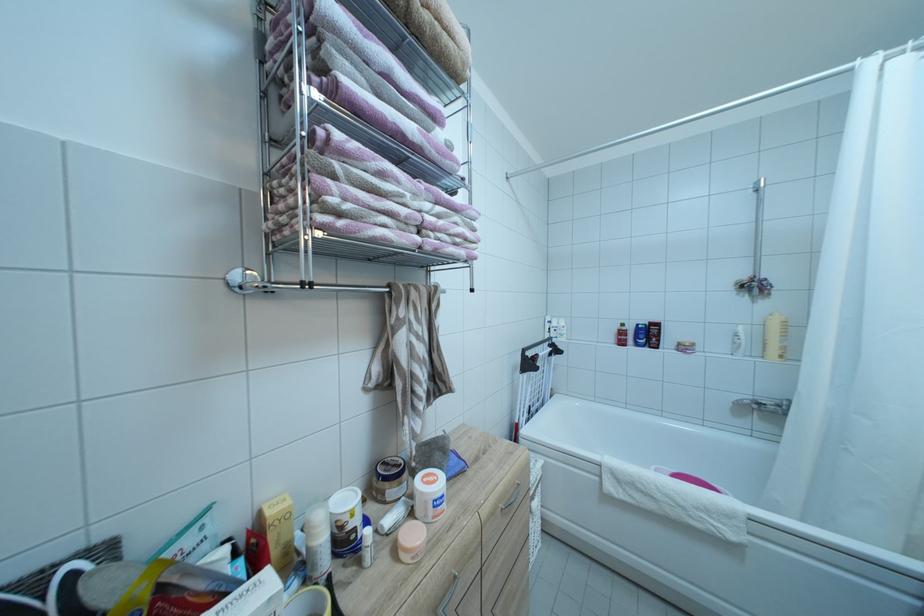
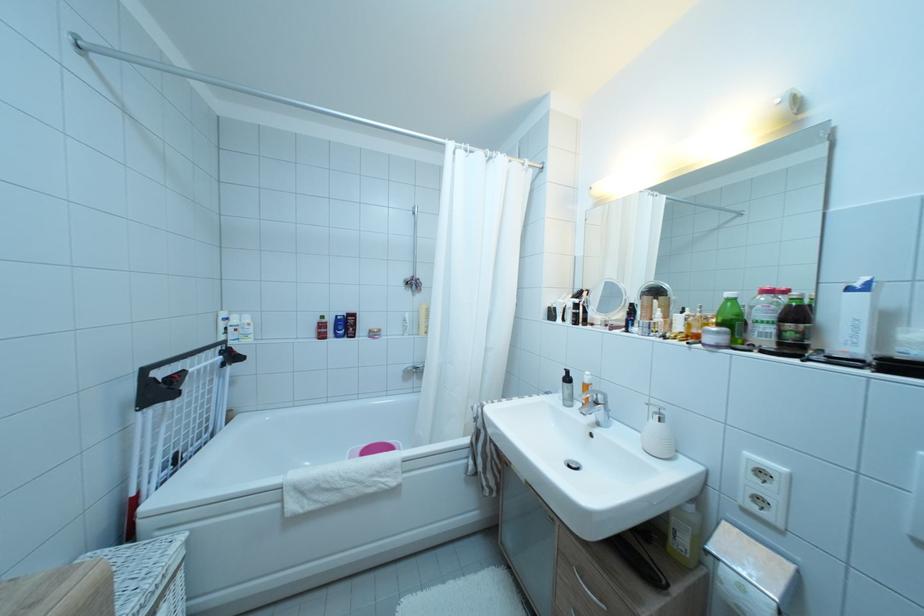
Find the pixel in the second image that matches (642,342) in the first image.

(343, 334)